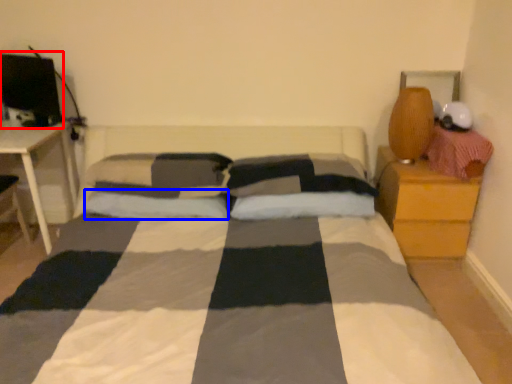
Question: Which point is closer to the camera, computer monitor (highlighted by a red box) or pillow (highlighted by a blue box)?

Choices:
 (A) computer monitor
 (B) pillow

Answer: (B)